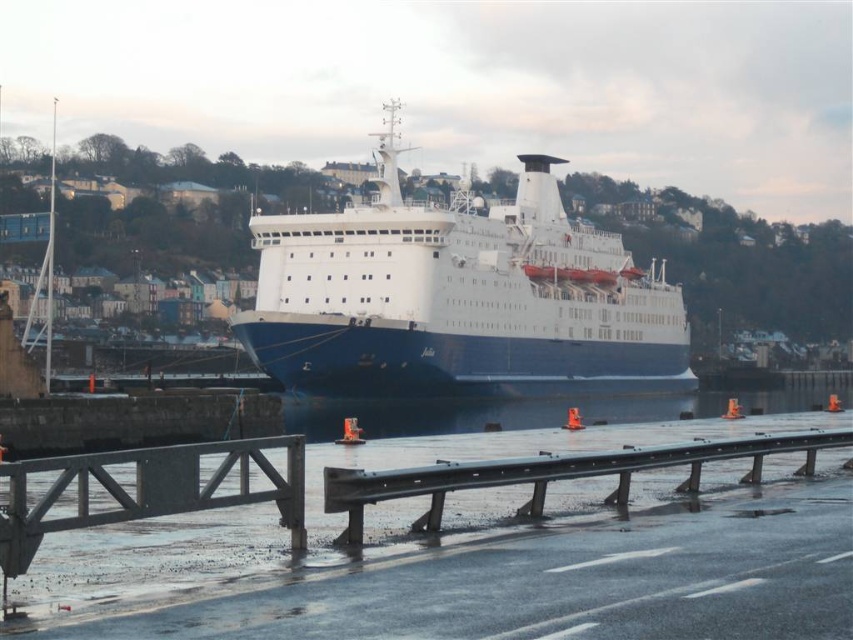
Question: Which of the following is the farthest from the observer?

Choices:
 (A) blue matte/clear ship at center
 (B) smooth concrete dock at center

Answer: (A)

Question: Is blue matte/clear ship at center positioned before blue rubber boat at center?

Choices:
 (A) no
 (B) yes

Answer: (A)

Question: Which of the following is the farthest from the observer?

Choices:
 (A) blue matte/clear ship at center
 (B) blue rubber boat at center

Answer: (A)

Question: Which of these objects is positioned farthest from the blue matte/clear ship at center?

Choices:
 (A) smooth concrete dock at center
 (B) blue rubber boat at center

Answer: (A)

Question: Does blue matte/clear ship at center appear on the right side of smooth concrete dock at center?

Choices:
 (A) no
 (B) yes

Answer: (B)

Question: Is blue matte/clear ship at center below smooth concrete dock at center?

Choices:
 (A) yes
 (B) no

Answer: (B)